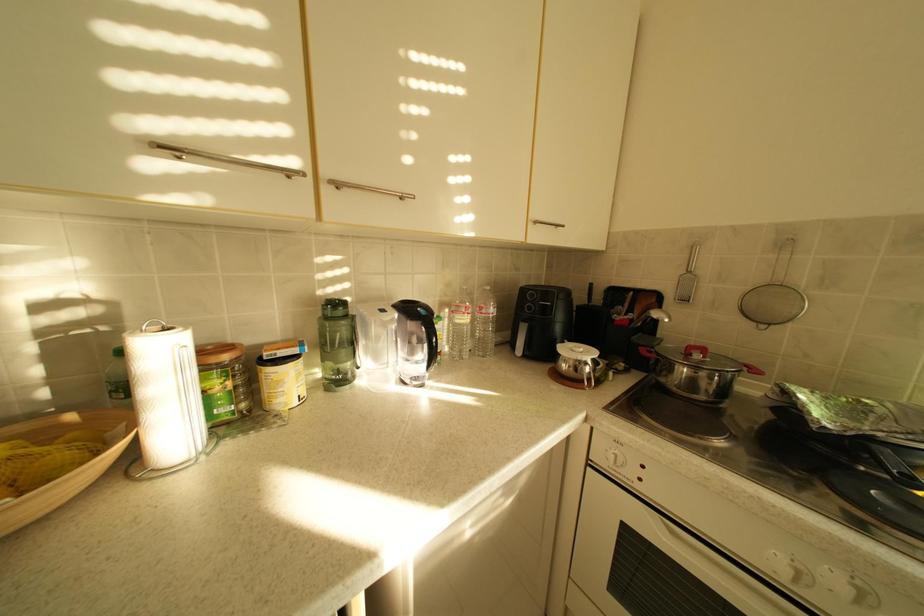
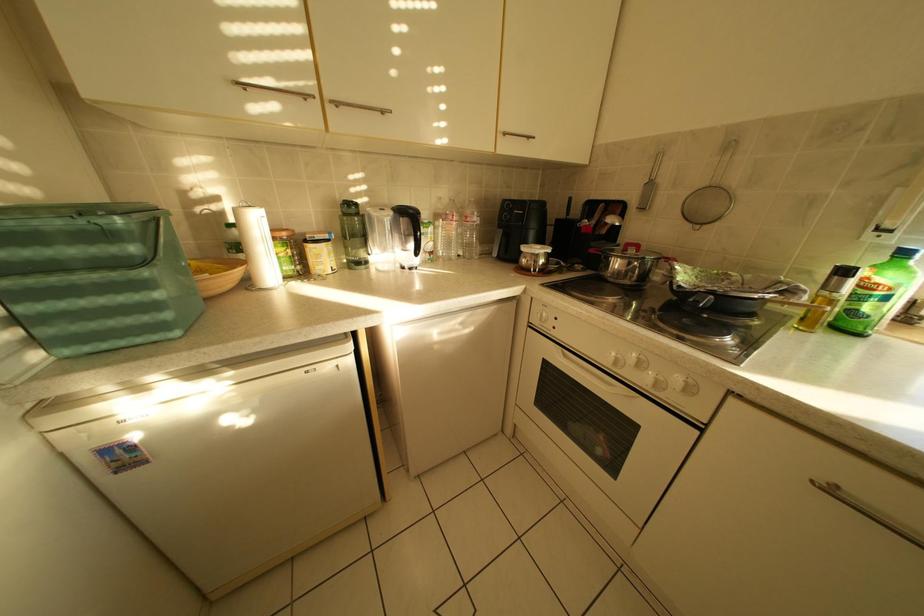
The images are taken continuously from a first-person perspective. In which direction are you moving?

The movement direction of the cameraman is right, backward.